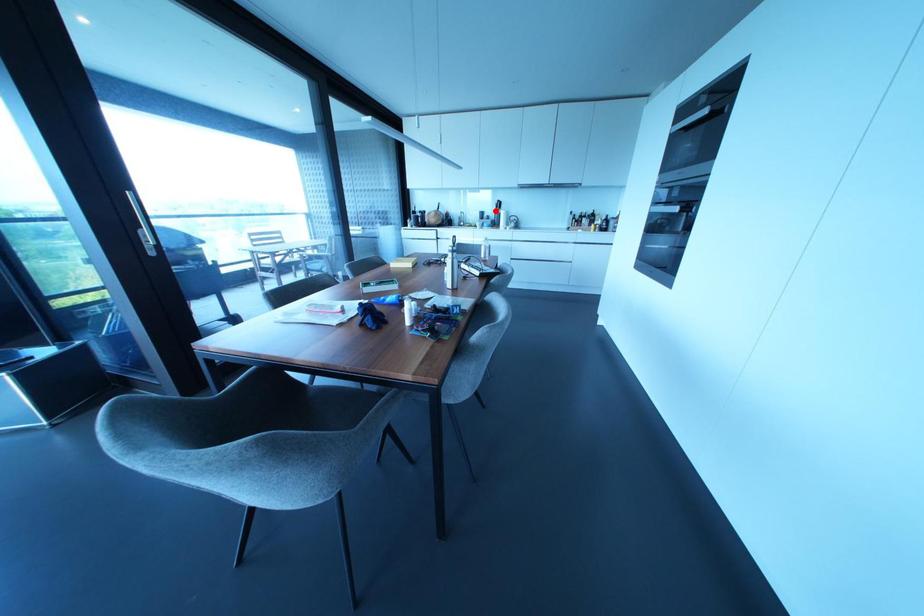
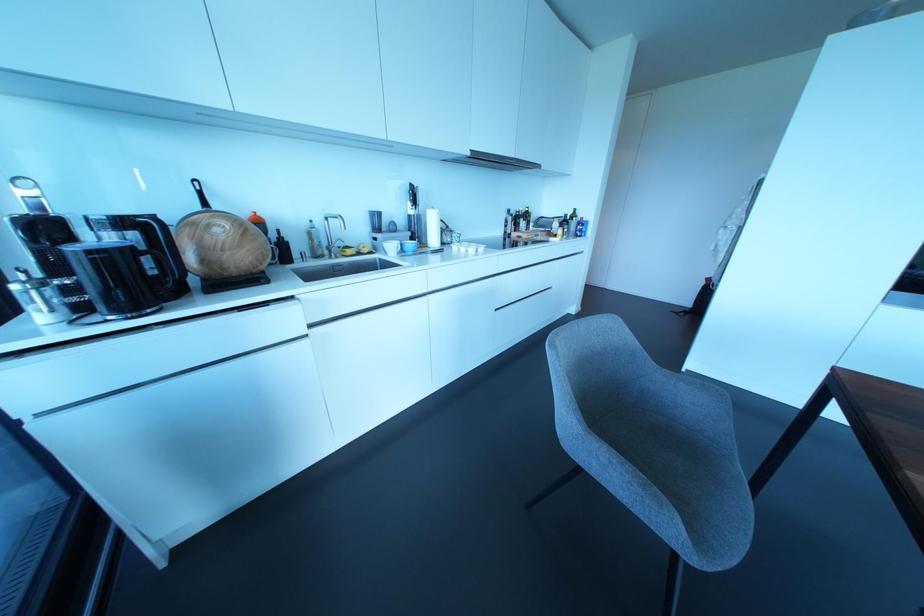
Question: I am providing you with two images of the same scene from different viewpoints. Given a red point in image1, look at the same physical point in image2. Is it:

Choices:
 (A) Closer to the viewpoint
 (B) Farther from the viewpoint

Answer: (B)